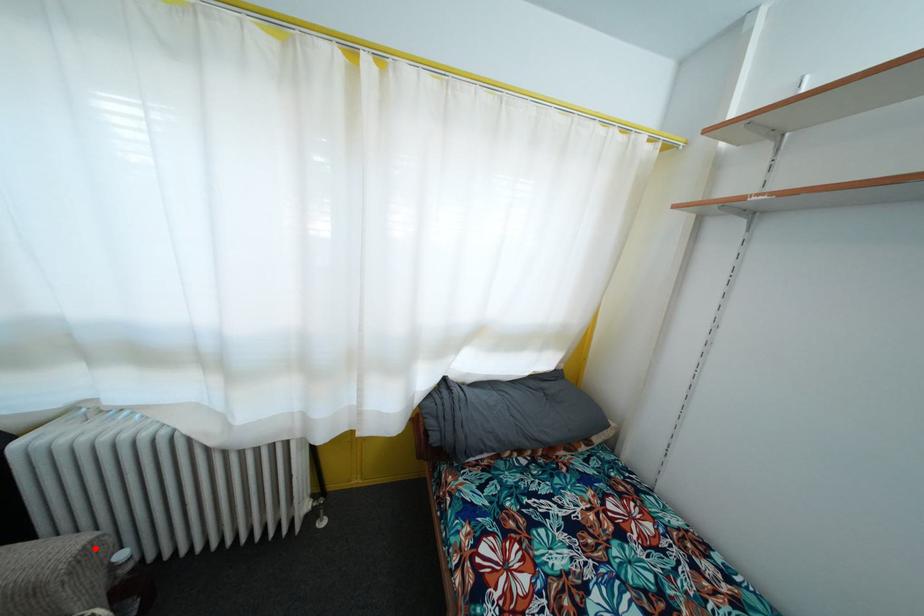
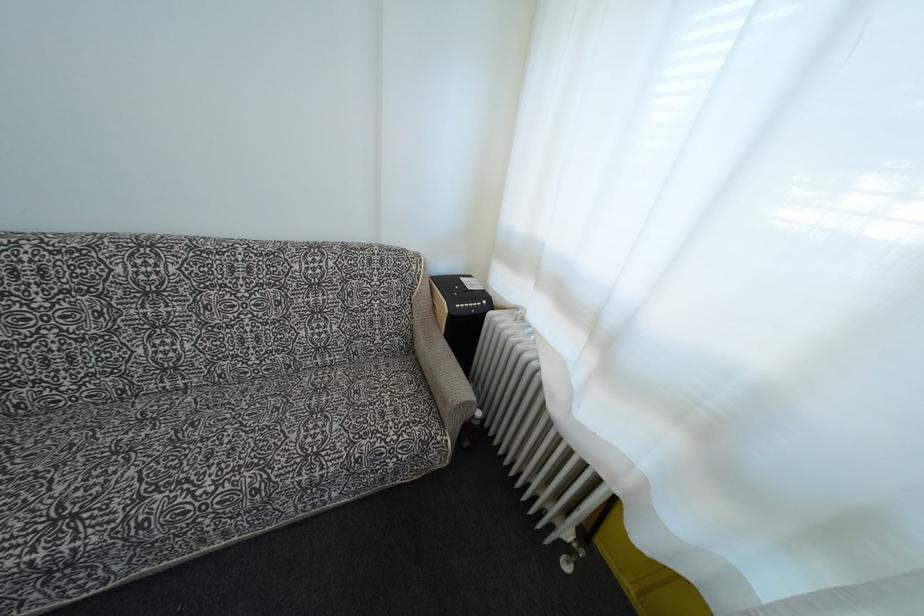
Where in the second image is the point corresponding to the highlighted location from the first image?

(472, 408)